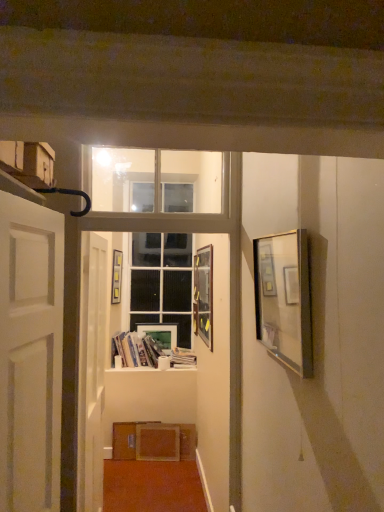
Question: Does metallic silver picture frame at center, which appears as the third picture frame when viewed from the back, appear on the left side of white matte door at left, which appears as the 1th door when viewed from the front?

Choices:
 (A) no
 (B) yes

Answer: (A)

Question: Is metallic silver picture frame at center, which appears as the third picture frame when viewed from the back, touching white matte door at left, which ranks as the second door in back-to-front order?

Choices:
 (A) yes
 (B) no

Answer: (B)

Question: Is metallic silver picture frame at center, marked as the 3th picture frame in a left-to-right arrangement, not close to white matte door at left, which ranks as the second door in back-to-front order?

Choices:
 (A) yes
 (B) no

Answer: (A)

Question: Does metallic silver picture frame at center, the second picture frame in the right-to-left sequence, come behind white matte door at left, which ranks as the second door in back-to-front order?

Choices:
 (A) no
 (B) yes

Answer: (B)

Question: Is the depth of metallic silver picture frame at center, the second picture frame in the right-to-left sequence, less than that of white matte door at left, which appears as the 1th door when viewed from the front?

Choices:
 (A) yes
 (B) no

Answer: (B)

Question: From the image's perspective, is metallic silver picture frame at center, which appears as the third picture frame when viewed from the back, beneath white matte door at left, which ranks as the second door in back-to-front order?

Choices:
 (A) yes
 (B) no

Answer: (B)

Question: From the image's perspective, is white matte door at left, which appears as the 1th door when viewed from the front, beneath metallic silver picture frame at center, which appears as the third picture frame when viewed from the back?

Choices:
 (A) yes
 (B) no

Answer: (A)

Question: Is white matte door at left, which ranks as the second door in back-to-front order, located outside metallic silver picture frame at center, marked as the 3th picture frame in a left-to-right arrangement?

Choices:
 (A) no
 (B) yes

Answer: (B)

Question: Is metallic silver picture frame at center, which appears as the third picture frame when viewed from the back, completely or partially inside white matte door at left, which appears as the 1th door when viewed from the front?

Choices:
 (A) no
 (B) yes

Answer: (A)

Question: Considering the relative positions of white matte door at left, which ranks as the second door in back-to-front order, and metallic silver picture frame at center, the second picture frame in the right-to-left sequence, in the image provided, is white matte door at left, which ranks as the second door in back-to-front order, to the left of metallic silver picture frame at center, the second picture frame in the right-to-left sequence, from the viewer's perspective?

Choices:
 (A) yes
 (B) no

Answer: (A)

Question: Is white matte door at left, which appears as the 1th door when viewed from the front, positioned before metallic silver picture frame at center, marked as the 3th picture frame in a left-to-right arrangement?

Choices:
 (A) yes
 (B) no

Answer: (A)

Question: Is white matte door at left, which ranks as the second door in back-to-front order, shorter than metallic silver picture frame at center, which is the 2th picture frame in front-to-back order?

Choices:
 (A) yes
 (B) no

Answer: (B)

Question: Considering the relative sizes of white glossy door at center, which is counted as the 2th door, starting from the front, and white matte door at left, which appears as the 1th door when viewed from the front, in the image provided, is white glossy door at center, which is counted as the 2th door, starting from the front, taller than white matte door at left, which appears as the 1th door when viewed from the front,?

Choices:
 (A) yes
 (B) no

Answer: (A)